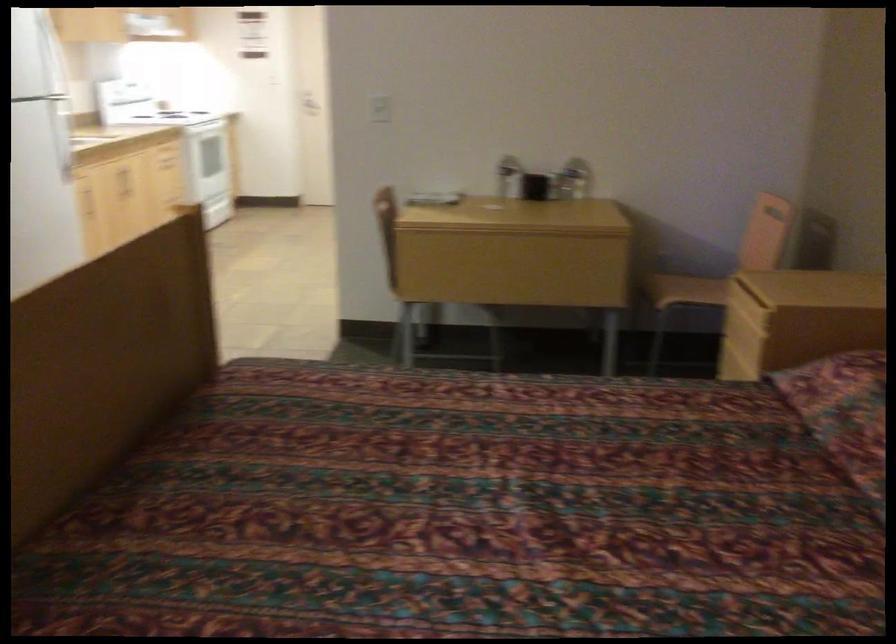
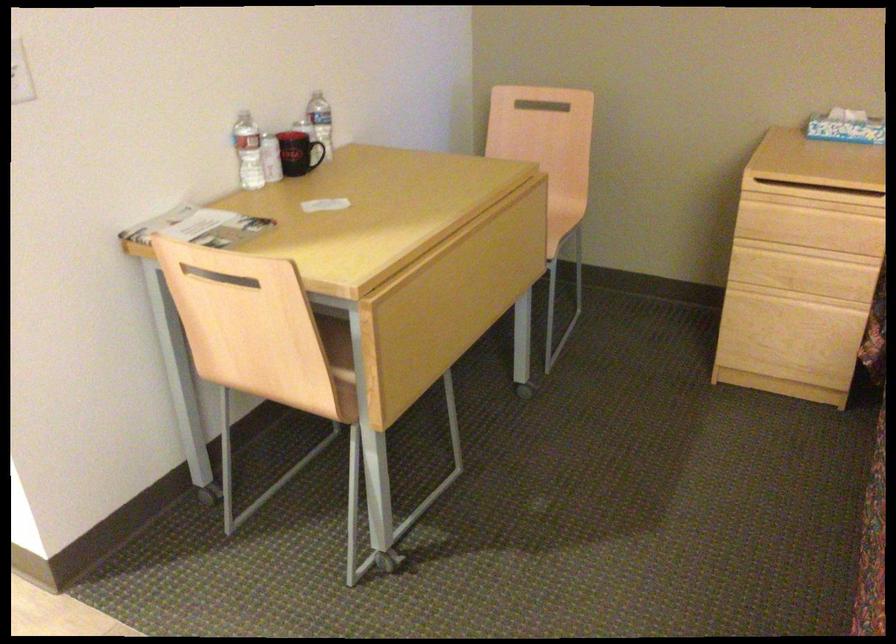
In the second image, find the point that corresponds to (621,267) in the first image.

(545, 225)